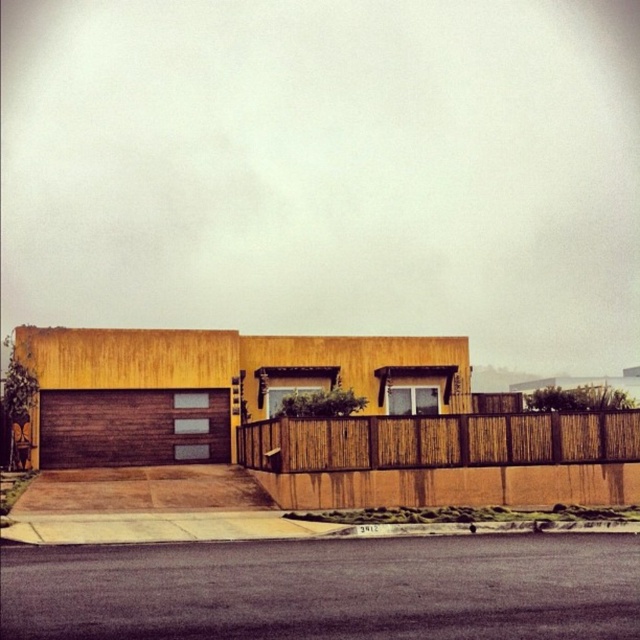
You are standing in front of the modern single story house and want to enter the garage. The brown wood garage at lower left and the brown textured garage door at lower left are both visible. Which one should you approach to access the garage entrance?

You should approach the brown textured garage door at lower left to access the garage entrance because the brown wood garage at lower left is to the right of it, indicating the door is the entrance point.